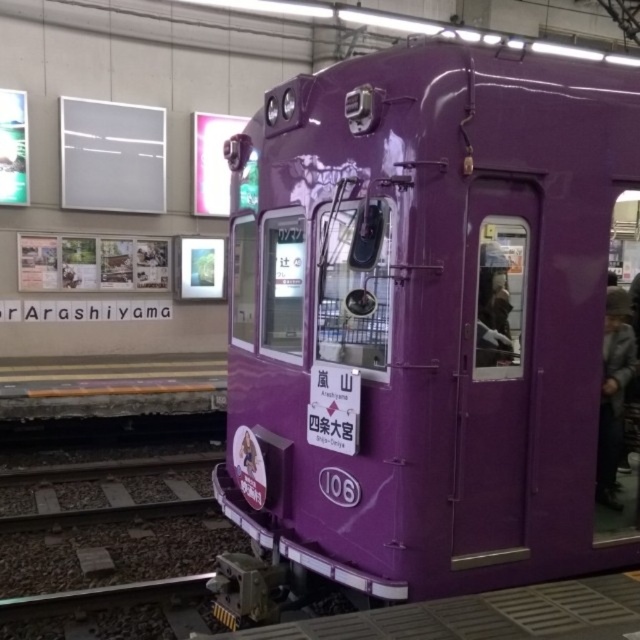
Question: Is matte purple train at center to the left of dark gray fabric coat at right from the viewer's perspective?

Choices:
 (A) yes
 (B) no

Answer: (A)

Question: Is matte purple train at center bigger than dark gray fabric coat at right?

Choices:
 (A) yes
 (B) no

Answer: (A)

Question: Which point is farther to the camera?

Choices:
 (A) matte purple train at center
 (B) dark gray fabric coat at right

Answer: (B)

Question: Which object appears farthest from the camera in this image?

Choices:
 (A) dark gray fabric coat at right
 (B) matte purple train at center

Answer: (A)

Question: Is matte purple train at center below dark gray fabric coat at right?

Choices:
 (A) no
 (B) yes

Answer: (A)